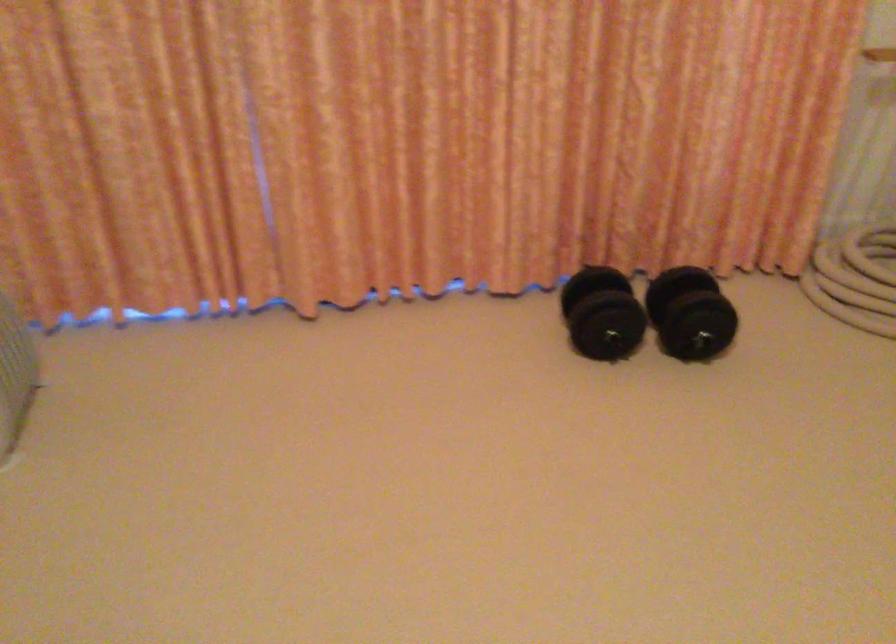
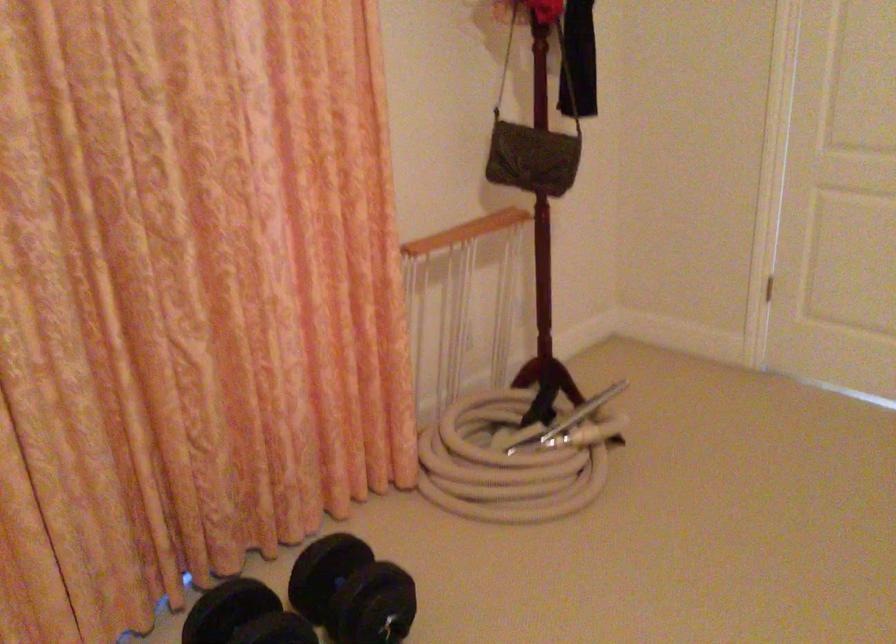
The point at (x=606, y=292) is marked in the first image. Where is the corresponding point in the second image?

(244, 617)